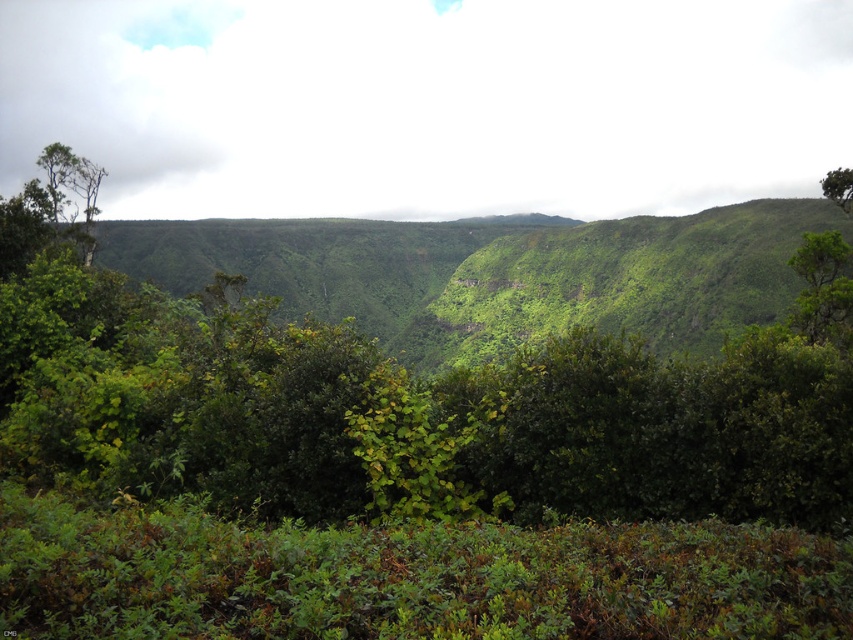
Who is shorter, green leafy tree at right or green leafy tree at upper right?

Standing shorter between the two is green leafy tree at right.

Can you confirm if green leafy tree at right is positioned to the left of green leafy tree at upper right?

Yes, green leafy tree at right is to the left of green leafy tree at upper right.

This screenshot has width=853, height=640. Find the location of `green leafy tree at right`. green leafy tree at right is located at coordinates (822, 289).

Identify the location of green leafy tree at right. (822, 289).

Is point (4, 132) less distant than point (850, 252)?

No, (4, 132) is further to viewer.

Image resolution: width=853 pixels, height=640 pixels. What are the coordinates of `white fluffy cloud at upper center` in the screenshot? It's located at (428, 104).

Is white fluffy cloud at upper center behind green leafy tree at upper right?

Yes, it is.

Is point (305, 205) farther from camera compared to point (851, 176)?

Yes, it is.

This screenshot has width=853, height=640. Find the location of `white fluffy cloud at upper center`. white fluffy cloud at upper center is located at coordinates (428, 104).